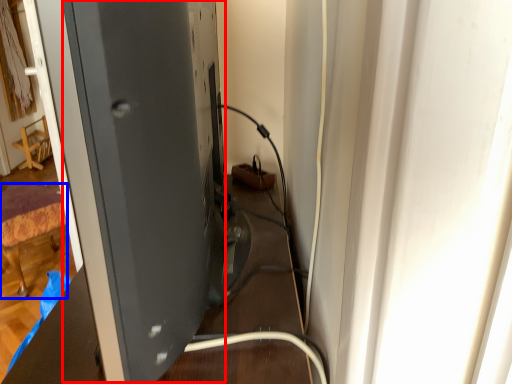
Question: Which point is closer to the camera, wide (highlighted by a red box) or furniture (highlighted by a blue box)?

Choices:
 (A) wide
 (B) furniture

Answer: (A)